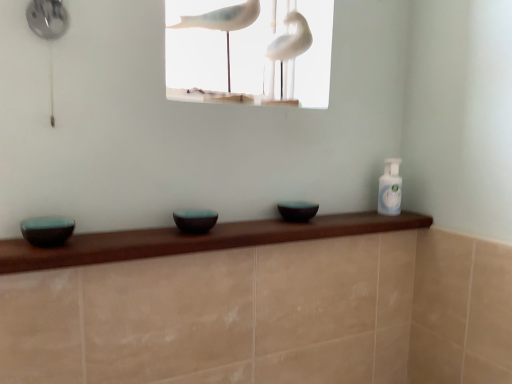
What is the approximate height of white matte birds at upper center?

11.94 inches.

Consider the image. In order to face white glossy bird at upper center, should I rotate leftwards or rightwards?

It's best to rotate right around 3.845 degrees.

What do you see at coordinates (297, 211) in the screenshot?
I see `matte black bowl at center, positioned as the 3th basin in left-to-right order` at bounding box center [297, 211].

What do you see at coordinates (47, 230) in the screenshot? Image resolution: width=512 pixels, height=384 pixels. I see `teal glossy bowl at left, which is the third basin in back-to-front order` at bounding box center [47, 230].

Where is `white matte birds at upper center`? Image resolution: width=512 pixels, height=384 pixels. white matte birds at upper center is located at coordinates (249, 51).

From a real-world perspective, is teal glossy bowl at left, which is the third basin in back-to-front order, above or below white glossy bird at upper center?

Clearly, from a real-world perspective, teal glossy bowl at left, which is the third basin in back-to-front order, is below white glossy bird at upper center.

Can you tell me how much teal glossy bowl at left, which is the third basin in back-to-front order, and white glossy bird at upper center differ in facing direction?

teal glossy bowl at left, which is the third basin in back-to-front order, and white glossy bird at upper center are facing 28.9 degrees away from each other.

Is teal glossy bowl at left, which is the third basin from right to left, in front of white glossy bird at upper center?

Yes.

Relative to clear plastic bottle at upper right, is white glossy bird at upper center in front or behind?

white glossy bird at upper center is positioned closer to the viewer than clear plastic bottle at upper right.

Is white glossy bird at upper center wider than clear plastic bottle at upper right?

Yes.

The width and height of the screenshot is (512, 384). Find the location of `bird in front of the clear plastic bottle at upper right`. bird in front of the clear plastic bottle at upper right is located at coordinates (291, 40).

From a real-world perspective, between white glossy bird at upper center and clear plastic bottle at upper right, who is vertically lower?

clear plastic bottle at upper right is physically lower.

Do you think white glossy bird at upper center is within white matte birds at upper center, or outside of it?

white glossy bird at upper center is spatially situated outside white matte birds at upper center.

Can you tell me how much white glossy bird at upper center and white matte birds at upper center differ in facing direction?

The angle between the facing direction of white glossy bird at upper center and the facing direction of white matte birds at upper center is 12 degrees.

From the image's perspective, which one is positioned lower, white glossy bird at upper center or white matte birds at upper center?

white glossy bird at upper center.

Between white glossy bird at upper center and white matte birds at upper center, which one has smaller width?

Thinner between the two is white glossy bird at upper center.

Is white glossy bird at upper center bigger or smaller than matte black bowl at center, which is counted as the 2th basin, starting from the left?

white glossy bird at upper center is bigger than matte black bowl at center, which is counted as the 2th basin, starting from the left.

Is white glossy bird at upper center not within matte black bowl at center, the second basin positioned from the front?

Yes, white glossy bird at upper center is located beyond the bounds of matte black bowl at center, the second basin positioned from the front.

Based on the photo, is white glossy bird at upper center aimed at matte black bowl at center, which is counted as the 2th basin, starting from the left?

No, white glossy bird at upper center is not turned towards matte black bowl at center, which is counted as the 2th basin, starting from the left.

Where is `bird above the matte black bowl at center, which appears as the 2th basin when viewed from the back (from the image's perspective)`? This screenshot has height=384, width=512. bird above the matte black bowl at center, which appears as the 2th basin when viewed from the back (from the image's perspective) is located at coordinates (291, 40).

Considering the sizes of objects clear plastic bottle at upper right and matte black bowl at center, which is counted as the 2th basin, starting from the left, in the image provided, who is bigger, clear plastic bottle at upper right or matte black bowl at center, which is counted as the 2th basin, starting from the left,?

clear plastic bottle at upper right is bigger.

I want to click on basin that is the 2nd object located in front of the clear plastic bottle at upper right, so click(195, 220).

Could you tell me if clear plastic bottle at upper right is turned towards matte black bowl at center, the second basin positioned from the front?

No, clear plastic bottle at upper right is not facing towards matte black bowl at center, the second basin positioned from the front.

Does matte black bowl at center, the second basin positioned from the front, turn towards clear plastic bottle at upper right?

No, matte black bowl at center, the second basin positioned from the front, is not aimed at clear plastic bottle at upper right.

Does matte black bowl at center, the second basin positioned from the front, have a greater width compared to clear plastic bottle at upper right?

Answer: Indeed, matte black bowl at center, the second basin positioned from the front, has a greater width compared to clear plastic bottle at upper right.

Can you tell me how much matte black bowl at center, which is counted as the 2th basin, starting from the left, and clear plastic bottle at upper right differ in facing direction?

There is a 0.178-degree angle between the facing directions of matte black bowl at center, which is counted as the 2th basin, starting from the left, and clear plastic bottle at upper right.

Where is `bottle that appears above the matte black bowl at center, the second basin positioned from the front (from a real-world perspective)`? The image size is (512, 384). bottle that appears above the matte black bowl at center, the second basin positioned from the front (from a real-world perspective) is located at coordinates (390, 188).

Choose the correct answer: Is teal glossy bowl at left, which is counted as the 1th basin, starting from the front, inside matte black bowl at center, which is counted as the 2th basin, starting from the left, or outside it?

teal glossy bowl at left, which is counted as the 1th basin, starting from the front, is outside matte black bowl at center, which is counted as the 2th basin, starting from the left.

Is teal glossy bowl at left, which is the third basin from right to left, looking in the opposite direction of matte black bowl at center, which appears as the 2th basin when viewed from the back?

No, teal glossy bowl at left, which is the third basin from right to left, is not facing away from matte black bowl at center, which appears as the 2th basin when viewed from the back.

From the image's perspective, would you say teal glossy bowl at left, acting as the 1th basin starting from the left, is positioned over matte black bowl at center, the 2th basin viewed from the right?

No.

Is teal glossy bowl at left, which is the third basin in back-to-front order, positioned far away from matte black bowl at center, which appears as the 2th basin when viewed from the back?

No, teal glossy bowl at left, which is the third basin in back-to-front order, is not far away from matte black bowl at center, which appears as the 2th basin when viewed from the back.

There is a white glossy bird at upper center. Identify the location of the 3rd basin below it (from a real-world perspective). (47, 230).

Where is `bird that appears in front of the clear plastic bottle at upper right`? bird that appears in front of the clear plastic bottle at upper right is located at coordinates (291, 40).

When comparing their distances from matte black bowl at center, which appears as the 2th basin when viewed from the back, does teal glossy bowl at left, which is the third basin in back-to-front order, or white matte birds at upper center seem further?

The object further to matte black bowl at center, which appears as the 2th basin when viewed from the back, is white matte birds at upper center.

Looking at the image, which one is located further to clear plastic bottle at upper right, matte black bowl at center, which is the third basin in front-to-back order, or teal glossy bowl at left, acting as the 1th basin starting from the left?

Based on the image, teal glossy bowl at left, acting as the 1th basin starting from the left, appears to be further to clear plastic bottle at upper right.

Looking at the image, which one is located closer to matte black bowl at center, which is counted as the 2th basin, starting from the left, matte black bowl at center, positioned as the 3th basin in left-to-right order, or white glossy bird at upper center?

The object closer to matte black bowl at center, which is counted as the 2th basin, starting from the left, is matte black bowl at center, positioned as the 3th basin in left-to-right order.

When comparing their distances from white glossy bird at upper center, does white matte birds at upper center or matte black bowl at center, which appears as the 2th basin when viewed from the back, seem closer?

Based on the image, white matte birds at upper center appears to be nearer to white glossy bird at upper center.

Based on their spatial positions, is clear plastic bottle at upper right or matte black bowl at center, the 2th basin viewed from the right, further from white glossy bird at upper center?

matte black bowl at center, the 2th basin viewed from the right, is further to white glossy bird at upper center.

Looking at this image, from the image, which object appears to be nearer to white matte birds at upper center, teal glossy bowl at left, acting as the 1th basin starting from the left, or matte black bowl at center, which is counted as the 2th basin, starting from the left?

matte black bowl at center, which is counted as the 2th basin, starting from the left, lies closer to white matte birds at upper center than the other object.

When comparing their distances from clear plastic bottle at upper right, does matte black bowl at center, which is the third basin in front-to-back order, or matte black bowl at center, which is counted as the 2th basin, starting from the left, seem further?

The object further to clear plastic bottle at upper right is matte black bowl at center, which is counted as the 2th basin, starting from the left.

Estimate the real-world distances between objects in this image. Which object is further from white matte birds at upper center, matte black bowl at center, the second basin positioned from the front, or white glossy bird at upper center?

matte black bowl at center, the second basin positioned from the front, is positioned further to the anchor white matte birds at upper center.

The height and width of the screenshot is (384, 512). Find the location of `bird between white matte birds at upper center and matte black bowl at center, which appears as the 1th basin when viewed from the right, in the up-down direction`. bird between white matte birds at upper center and matte black bowl at center, which appears as the 1th basin when viewed from the right, in the up-down direction is located at coordinates (291, 40).

In order to click on basin between white glossy bird at upper center and matte black bowl at center, the second basin positioned from the front, vertically in this screenshot , I will do `click(297, 211)`.

Image resolution: width=512 pixels, height=384 pixels. I want to click on bottle between white matte birds at upper center and matte black bowl at center, placed as the first basin when sorted from back to front, vertically, so click(390, 188).

Image resolution: width=512 pixels, height=384 pixels. In order to click on bird located between teal glossy bowl at left, which is the third basin from right to left, and matte black bowl at center, positioned as the 3th basin in left-to-right order, in the left-right direction in this screenshot , I will do `click(291, 40)`.